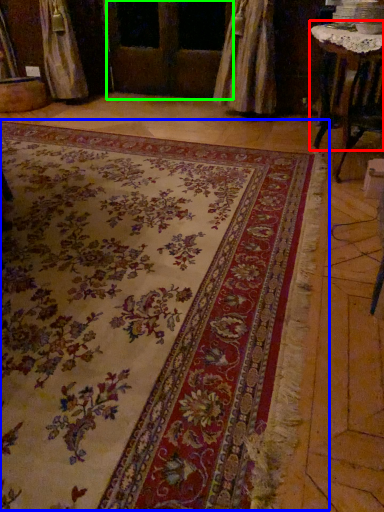
Question: Considering the real-world distances, which object is farthest from table (highlighted by a red box)? mat (highlighted by a blue box) or screen door (highlighted by a green box)?

Choices:
 (A) mat
 (B) screen door

Answer: (B)